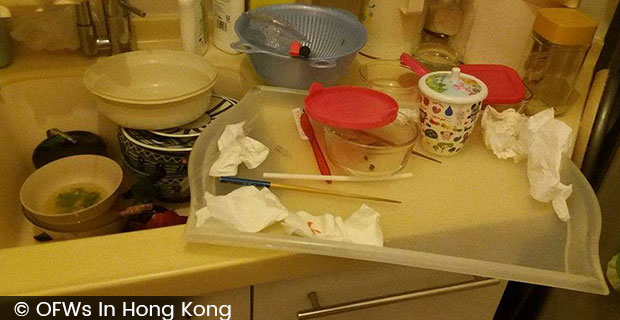
At what (x,y) coordinates should I click in order to perform the action: click on glass bowl. Please return your answer as a coordinate pair (x, y). The height and width of the screenshot is (320, 620). Looking at the image, I should click on (387, 161).